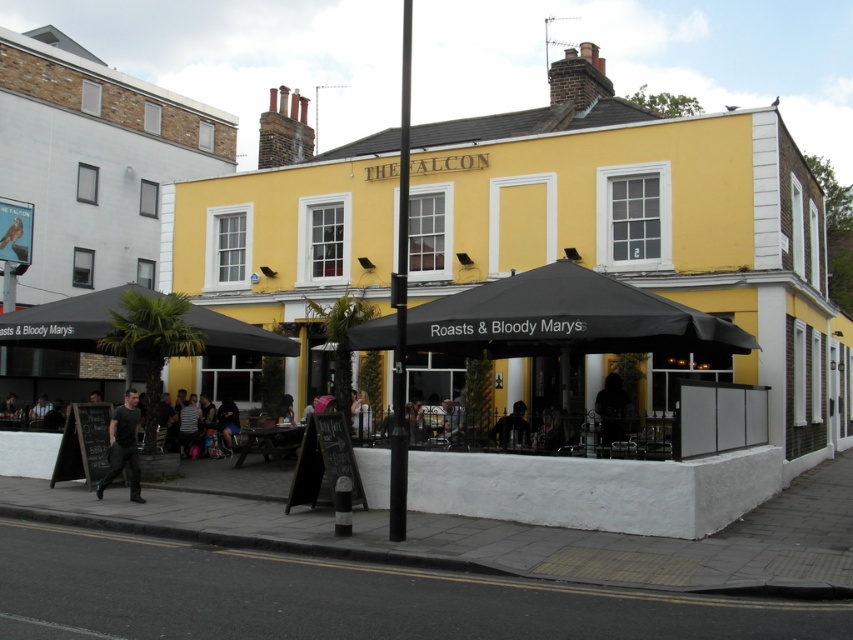
Does black matte shirt at center appear on the left side of dark blue jeans at lower center?

Correct, you'll find black matte shirt at center to the left of dark blue jeans at lower center.

Is point (126, 410) closer to viewer compared to point (225, 445)?

Yes, it is in front of point (225, 445).

Where is `black matte shirt at center`? The width and height of the screenshot is (853, 640). black matte shirt at center is located at coordinates (123, 445).

At what (x,y) coordinates should I click in order to perform the action: click on black matte shirt at center. Please return your answer as a coordinate pair (x, y). This screenshot has height=640, width=853. Looking at the image, I should click on (123, 445).

Who is taller, black fabric canopy at center or black matte shirt at center?

Standing taller between the two is black matte shirt at center.

What do you see at coordinates (552, 320) in the screenshot? The height and width of the screenshot is (640, 853). I see `black fabric canopy at center` at bounding box center [552, 320].

The width and height of the screenshot is (853, 640). I want to click on black fabric canopy at center, so tap(552, 320).

In the scene shown: Who is shorter, dark fabric figure at center or dark blue jeans at lower center?

Standing shorter between the two is dark fabric figure at center.

Which is in front, point (618, 412) or point (228, 406)?

Positioned in front is point (618, 412).

Is point (607, 445) positioned in front of point (229, 406)?

That is True.

The image size is (853, 640). I want to click on dark fabric figure at center, so click(612, 410).